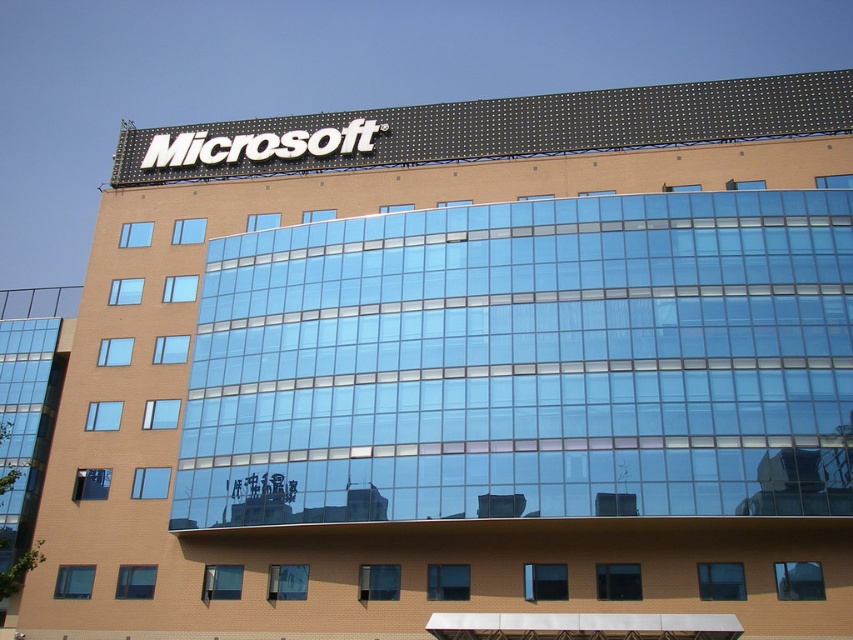
Question: Which point is closer to the camera taking this photo?

Choices:
 (A) (651, 145)
 (B) (173, 529)

Answer: (B)

Question: Which point is farther to the camera?

Choices:
 (A) (393, 122)
 (B) (323, 300)

Answer: (A)

Question: Which point is closer to the camera?

Choices:
 (A) transparent glass building at center
 (B) white sign at upper center

Answer: (A)

Question: Does transparent glass building at center have a greater width compared to white sign at upper center?

Choices:
 (A) yes
 (B) no

Answer: (B)

Question: Can you confirm if transparent glass building at center is thinner than white sign at upper center?

Choices:
 (A) yes
 (B) no

Answer: (A)

Question: Can you confirm if transparent glass building at center is wider than white sign at upper center?

Choices:
 (A) no
 (B) yes

Answer: (A)